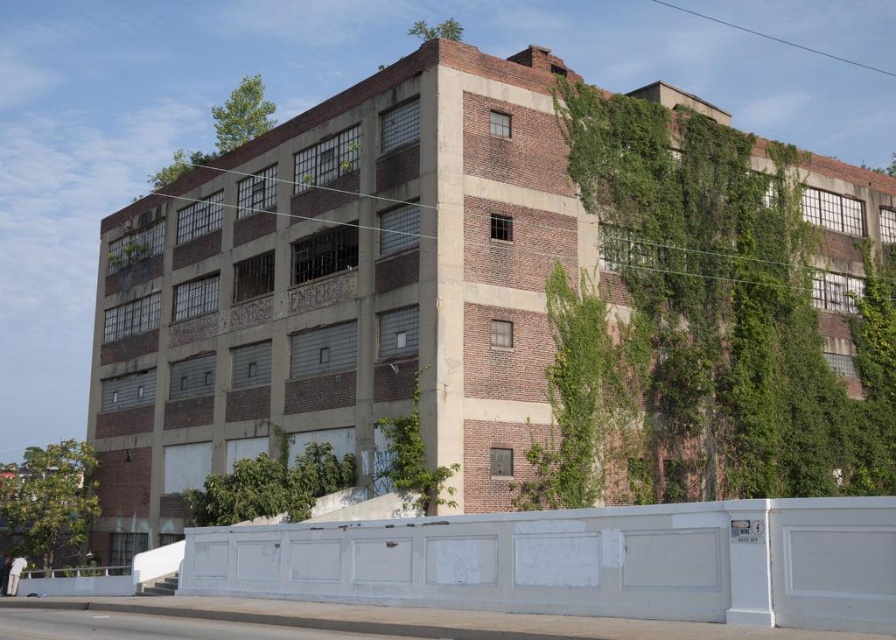
You are standing at point (48, 500) in the image of the old industrial building. What object is located exactly at this coordinate?

The green leafy tree at lower left is located exactly at point (48, 500).

You are a city planner assessing the building for potential green space integration. You notice two green leafy tree at lower left and green leafy plant at lower left. Which one is closer to the building?

Both the green leafy tree at lower left and green leafy plant at lower left are located at the lower left, but the green leafy plant at lower left is closer to the building since they are 79.83 feet apart.